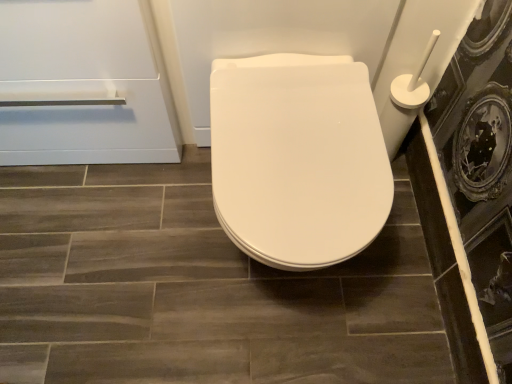
Question: From the image's perspective, relative to white glossy toilet seat at center, is matte ceramic tile at center above or below?

Choices:
 (A) above
 (B) below

Answer: (B)

Question: From a real-world perspective, is matte ceramic tile at center positioned above or below white glossy toilet seat at center?

Choices:
 (A) above
 (B) below

Answer: (B)

Question: Estimate the real-world distances between objects in this image. Which object is farther from the white glossy toilet seat at center?

Choices:
 (A) white glossy toilet seat at center
 (B) matte ceramic tile at center
 (C) transparent glass screen door at right

Answer: (B)

Question: Based on their relative distances, which object is farther from the white glossy toilet seat at center?

Choices:
 (A) matte ceramic tile at center
 (B) white glossy toilet seat at center
 (C) transparent glass screen door at right

Answer: (A)